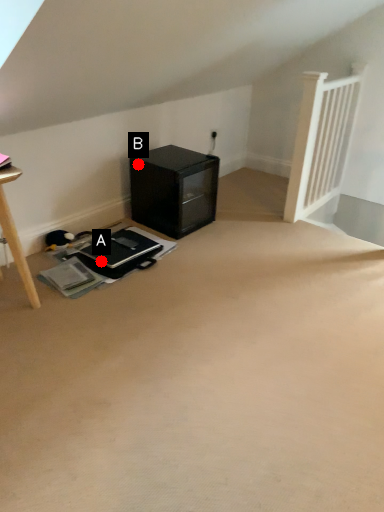
Question: Two points are circled on the image, labeled by A and B beside each circle. Which point is farther to the camera?

Choices:
 (A) A is further
 (B) B is further

Answer: (B)